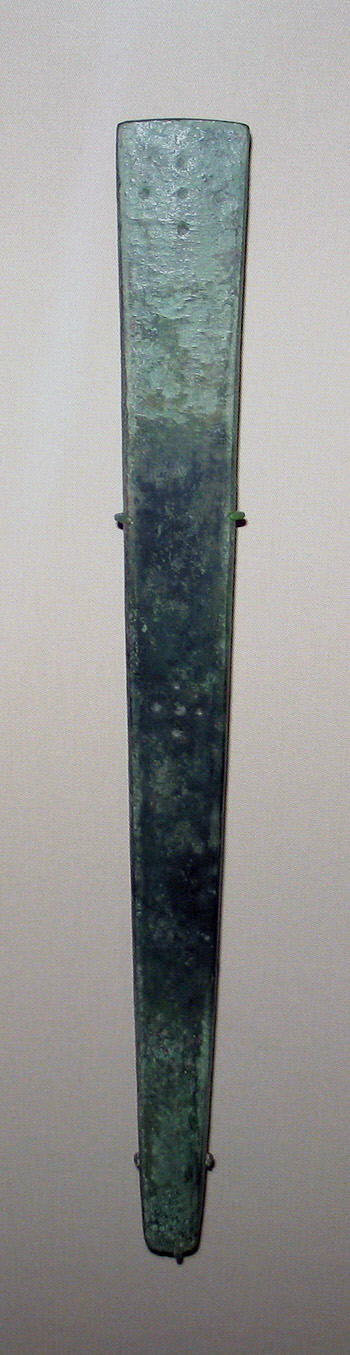
Identify the location of wall below art peice. (148, 1322).